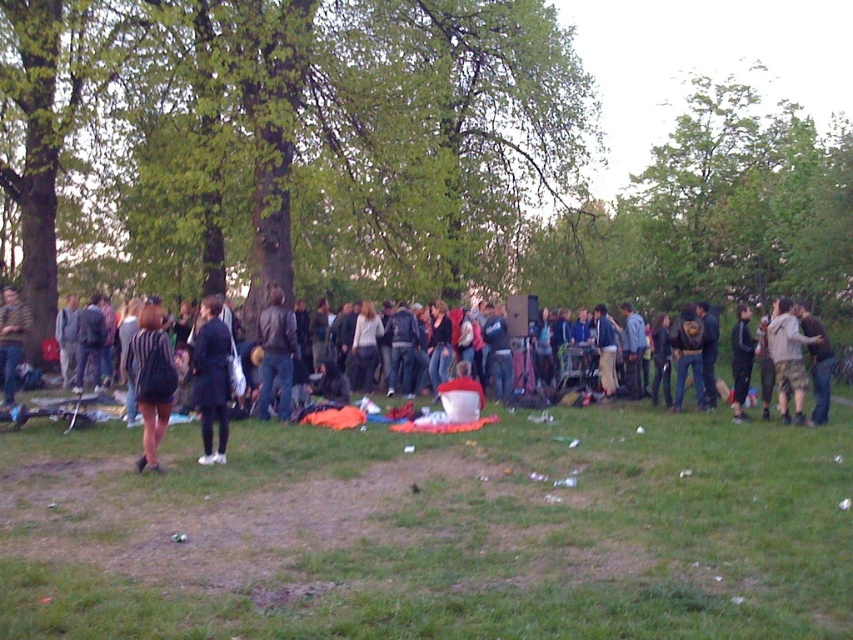
You are organizing a cleanup at the park and need to collect items from the ground. You see a leather jacket at center and a striped shirt at center. Which item should you pick up first if you want to collect the smaller item first?

The leather jacket at center is smaller than the striped shirt at center, so you should pick up the leather jacket at center first.

You are a photographer standing at the camera position. You want to capture a closeup shot of the camouflage pants at right. Can you reach it without moving from your current position?

The camouflage pants at right is 45.58 feet from camera, so you cannot reach it without moving from your current position because it is too far away.